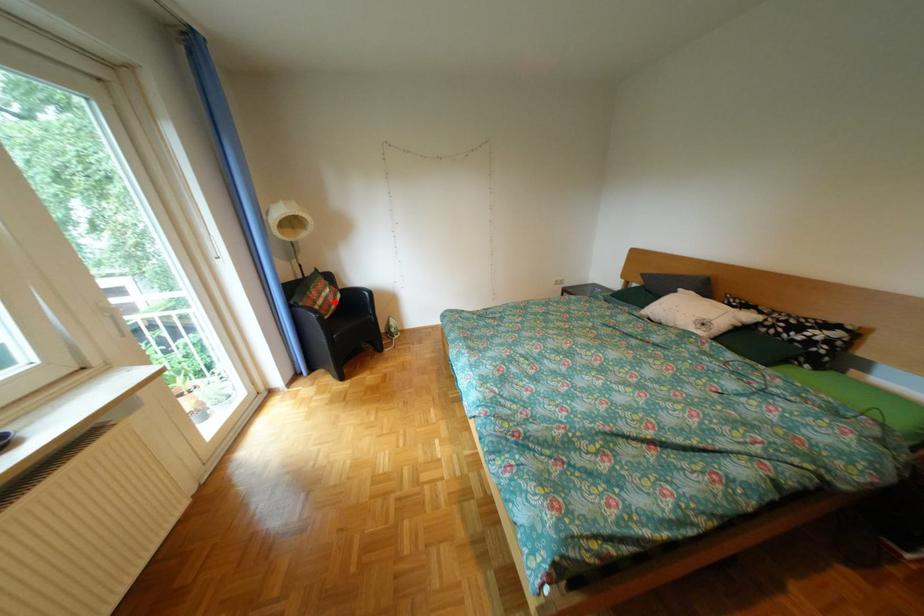
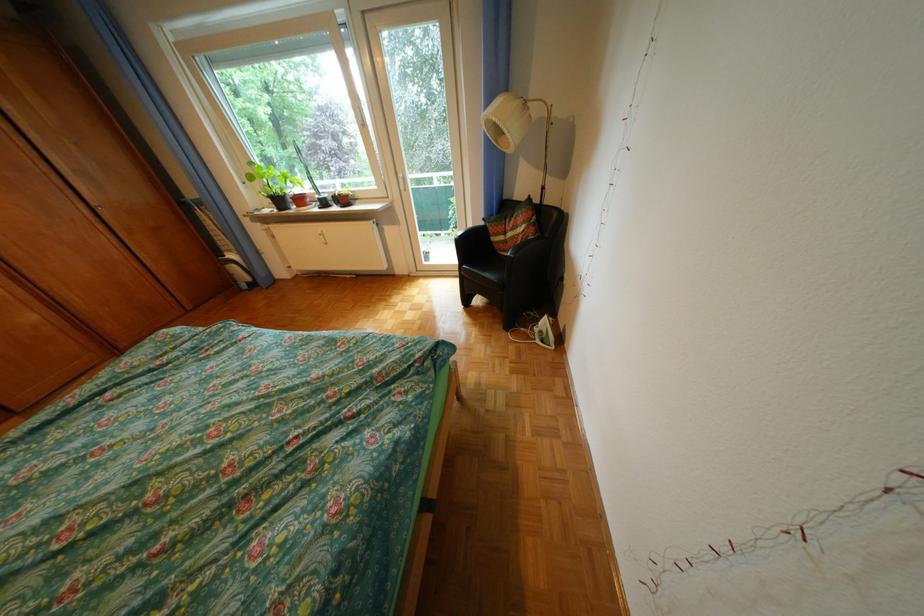
Find the pixel in the second image that matches the highlighted location in the first image.

(524, 236)